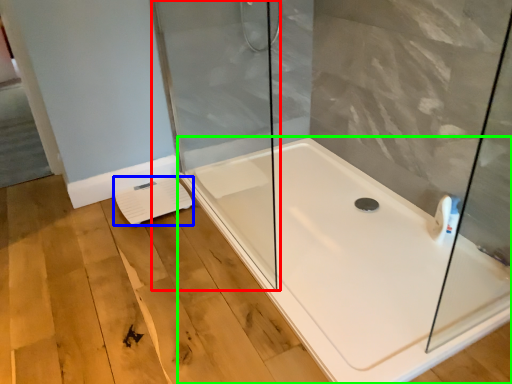
Question: Based on their relative distances, which object is farther from shower door (highlighted by a red box)? Choose from lift (highlighted by a blue box) and bathtub (highlighted by a green box).

Choices:
 (A) lift
 (B) bathtub

Answer: (B)